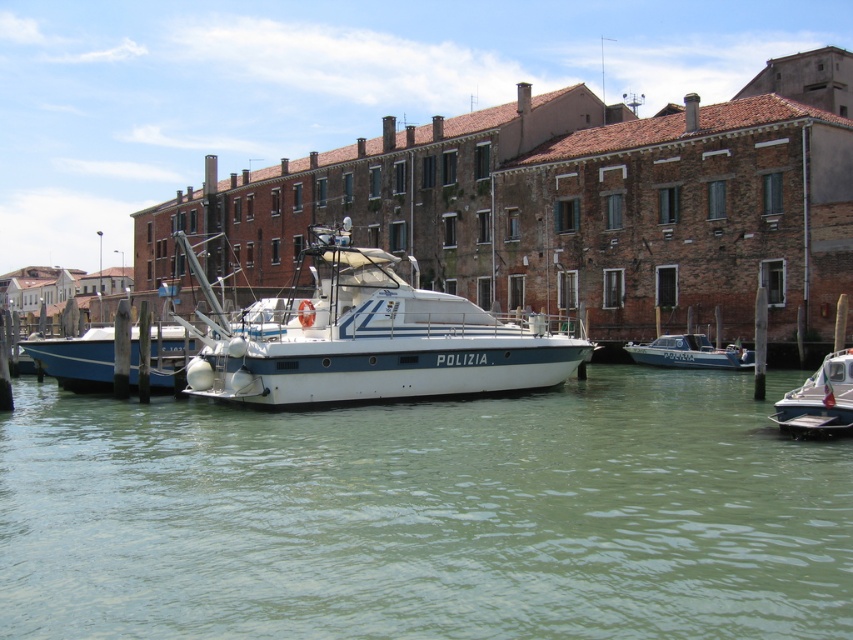
Question: Considering the relative positions of white glossy boat at center and white plastic boat at lower right in the image provided, where is white glossy boat at center located with respect to white plastic boat at lower right?

Choices:
 (A) left
 (B) right

Answer: (A)

Question: Among these points, which one is nearest to the camera?

Choices:
 (A) (164, 333)
 (B) (373, 336)

Answer: (B)

Question: Which object is closer to the camera taking this photo?

Choices:
 (A) white plastic boat at lower right
 (B) green water at center
 (C) metallic blue police boat at center

Answer: (B)

Question: Can you confirm if blue polished wood boat at center is smaller than white plastic boat at lower right?

Choices:
 (A) no
 (B) yes

Answer: (A)

Question: Which object appears closest to the camera in this image?

Choices:
 (A) blue polished wood boat at center
 (B) white glossy boat at center
 (C) metallic blue police boat at center
 (D) green water at center

Answer: (D)

Question: Is green water at center to the right of blue polished wood boat at center from the viewer's perspective?

Choices:
 (A) no
 (B) yes

Answer: (B)